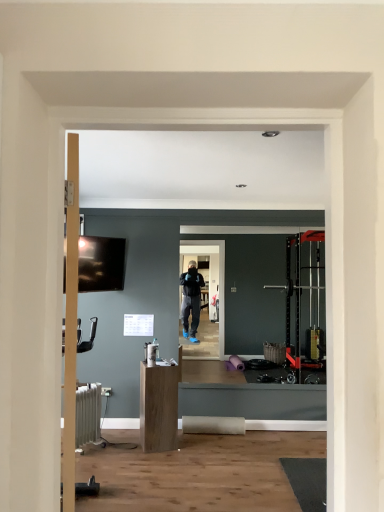
Image resolution: width=384 pixels, height=512 pixels. I want to click on white metallic radiator at lower left, so click(x=88, y=416).

What do you see at coordinates (159, 406) in the screenshot? The width and height of the screenshot is (384, 512). I see `light brown wood cabinet at center` at bounding box center [159, 406].

Image resolution: width=384 pixels, height=512 pixels. What are the coordinates of `white metallic radiator at lower left` in the screenshot? It's located at (88, 416).

Between point (95, 391) and point (177, 410), which one is positioned behind?

The point (177, 410) is farther.

Between white metallic radiator at lower left and light brown wood cabinet at center, which one appears on the right side from the viewer's perspective?

Positioned to the right is light brown wood cabinet at center.

Locate an element on the screen. This screenshot has width=384, height=512. furniture that is above the white metallic radiator at lower left (from a real-world perspective) is located at coordinates (159, 406).

Does white metallic radiator at lower left have a lesser height compared to light brown wood cabinet at center?

Yes.

Does light brown wood cabinet at center turn towards white metallic radiator at lower left?

No.

From the image's perspective, would you say light brown wood cabinet at center is shown under white metallic radiator at lower left?

No, from the image's perspective, light brown wood cabinet at center is not beneath white metallic radiator at lower left.

How distant is light brown wood cabinet at center from white metallic radiator at lower left?

light brown wood cabinet at center and white metallic radiator at lower left are 20.57 inches apart from each other.

Is light brown wood cabinet at center thinner than white metallic radiator at lower left?

No, light brown wood cabinet at center is not thinner than white metallic radiator at lower left.

Based on the photo, is white metallic radiator at lower left at the left side of matte black tv at upper left?

Indeed, white metallic radiator at lower left is positioned on the left side of matte black tv at upper left.

From a real-world perspective, who is located lower, white metallic radiator at lower left or matte black tv at upper left?

white metallic radiator at lower left.

Considering the sizes of objects white metallic radiator at lower left and matte black tv at upper left in the image provided, who is shorter, white metallic radiator at lower left or matte black tv at upper left?

With less height is white metallic radiator at lower left.

How different are the orientations of matte black tv at upper left and light brown wood cabinet at center in degrees?

The facing directions of matte black tv at upper left and light brown wood cabinet at center are 32.6 degrees apart.

Is matte black tv at upper left not near light brown wood cabinet at center?

Yes, matte black tv at upper left and light brown wood cabinet at center are quite far apart.

Considering the sizes of objects matte black tv at upper left and light brown wood cabinet at center in the image provided, who is taller, matte black tv at upper left or light brown wood cabinet at center?

Standing taller between the two is light brown wood cabinet at center.

The height and width of the screenshot is (512, 384). What are the coordinates of `television that is behind the light brown wood cabinet at center` in the screenshot? It's located at (101, 264).

Considering the sizes of objects matte black tv at upper left and white metallic radiator at lower left in the image provided, who is smaller, matte black tv at upper left or white metallic radiator at lower left?

With smaller size is matte black tv at upper left.

From the image's perspective, which is above, matte black tv at upper left or white metallic radiator at lower left?

matte black tv at upper left is shown above in the image.

Are matte black tv at upper left and white metallic radiator at lower left far apart?

matte black tv at upper left is positioned a significant distance from white metallic radiator at lower left.

Considering the points (89, 288) and (85, 418), which point is behind, point (89, 288) or point (85, 418)?

The point (89, 288) is more distant.

Where is `furniture on the right side of matte black tv at upper left`? furniture on the right side of matte black tv at upper left is located at coordinates (159, 406).

Looking at this image, can you confirm if light brown wood cabinet at center is shorter than matte black tv at upper left?

In fact, light brown wood cabinet at center may be taller than matte black tv at upper left.

From a real-world perspective, which is physically above, light brown wood cabinet at center or matte black tv at upper left?

From a 3D spatial view, matte black tv at upper left is above.

This screenshot has height=512, width=384. I want to click on radiator to the left of light brown wood cabinet at center, so click(88, 416).

Find the location of a particular element. This screenshot has width=384, height=512. furniture above the white metallic radiator at lower left (from a real-world perspective) is located at coordinates (159, 406).

From the image, which object appears to be nearer to white metallic radiator at lower left, matte black tv at upper left or light brown wood cabinet at center?

Based on the image, light brown wood cabinet at center appears to be nearer to white metallic radiator at lower left.

Considering their positions, is white metallic radiator at lower left positioned closer to matte black tv at upper left than light brown wood cabinet at center?

Based on the image, white metallic radiator at lower left appears to be nearer to matte black tv at upper left.

Based on their spatial positions, is light brown wood cabinet at center or matte black tv at upper left closer to white metallic radiator at lower left?

light brown wood cabinet at center is positioned closer to the anchor white metallic radiator at lower left.

From the image, which object appears to be farther from light brown wood cabinet at center, white metallic radiator at lower left or matte black tv at upper left?

matte black tv at upper left is further to light brown wood cabinet at center.

Based on their spatial positions, is matte black tv at upper left or white metallic radiator at lower left closer to light brown wood cabinet at center?

white metallic radiator at lower left is positioned closer to the anchor light brown wood cabinet at center.

From the image, which object appears to be nearer to matte black tv at upper left, light brown wood cabinet at center or white metallic radiator at lower left?

Among the two, white metallic radiator at lower left is located nearer to matte black tv at upper left.

At what (x,y) coordinates should I click in order to perform the action: click on furniture between matte black tv at upper left and white metallic radiator at lower left from top to bottom. Please return your answer as a coordinate pair (x, y). The image size is (384, 512). Looking at the image, I should click on (159, 406).